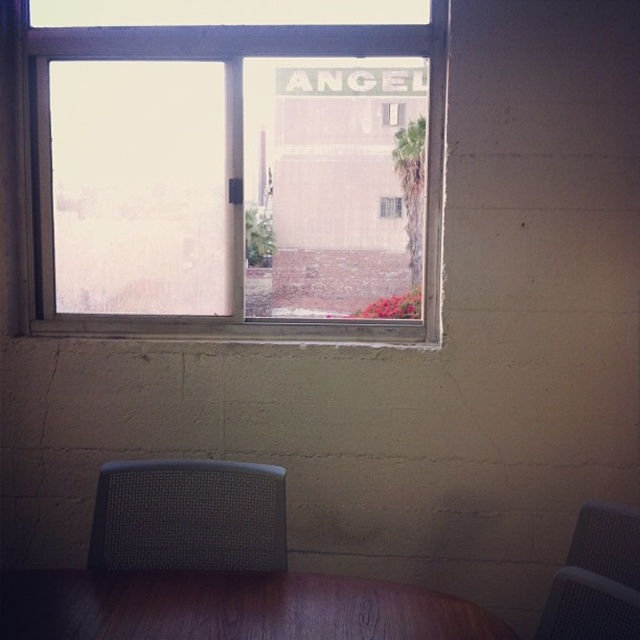
Between gray mesh chair at lower right and transparent glass window at center, which one has less height?

transparent glass window at center is shorter.

Based on the photo, is gray mesh chair at lower right below transparent glass window at center?

Correct, gray mesh chair at lower right is located below transparent glass window at center.

At what (x,y) coordinates should I click in order to perform the action: click on gray mesh chair at lower right. Please return your answer as a coordinate pair (x, y). This screenshot has width=640, height=640. Looking at the image, I should click on (596, 579).

Find the location of a particular element. gray mesh chair at lower right is located at coordinates (596, 579).

Does clear glass window at upper center have a greater width compared to gray mesh chair at lower left?

Yes, clear glass window at upper center is wider than gray mesh chair at lower left.

Does clear glass window at upper center lie behind gray mesh chair at lower left?

Yes, clear glass window at upper center is behind gray mesh chair at lower left.

Is point (74, 259) in front of point (157, 532)?

No, (74, 259) is further to viewer.

Find the location of a particular element. clear glass window at upper center is located at coordinates (230, 177).

Who is lower down, clear glass window at upper center or clear glass window at center?

clear glass window at center is below.

Does clear glass window at upper center have a lesser height compared to clear glass window at center?

Incorrect, clear glass window at upper center's height does not fall short of clear glass window at center's.

Where is `clear glass window at upper center`? Image resolution: width=640 pixels, height=640 pixels. clear glass window at upper center is located at coordinates (230, 177).